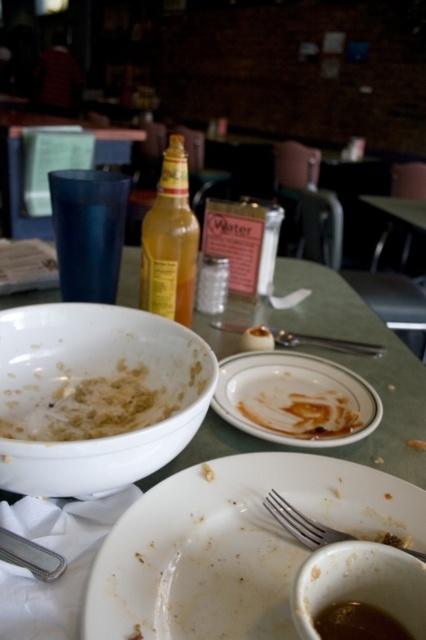
The width and height of the screenshot is (426, 640). Describe the element at coordinates (92, 406) in the screenshot. I see `white matte bowl at center` at that location.

Who is higher up, white matte bowl at center or brown matte soup at lower center?

white matte bowl at center

Is point (74, 396) closer to viewer compared to point (328, 624)?

That is False.

I want to click on white matte bowl at center, so click(92, 406).

Is white matte bowl at lower left bigger than white glossy plate at center?

Yes.

Can you confirm if white matte bowl at lower left is positioned below white glossy plate at center?

Actually, white matte bowl at lower left is above white glossy plate at center.

Identify the location of white matte bowl at lower left. This screenshot has width=426, height=640. (95, 396).

Can you confirm if white matte bowl at lower left is thinner than green plastic table at center?

Correct, white matte bowl at lower left's width is less than green plastic table at center's.

The image size is (426, 640). What do you see at coordinates (95, 396) in the screenshot?
I see `white matte bowl at lower left` at bounding box center [95, 396].

This screenshot has height=640, width=426. Identify the location of white matte bowl at lower left. point(95,396).